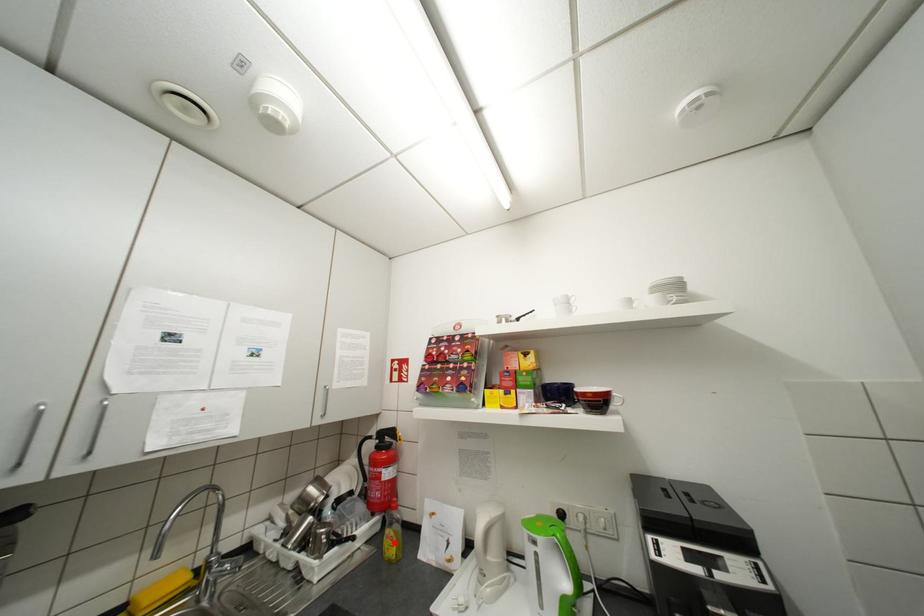
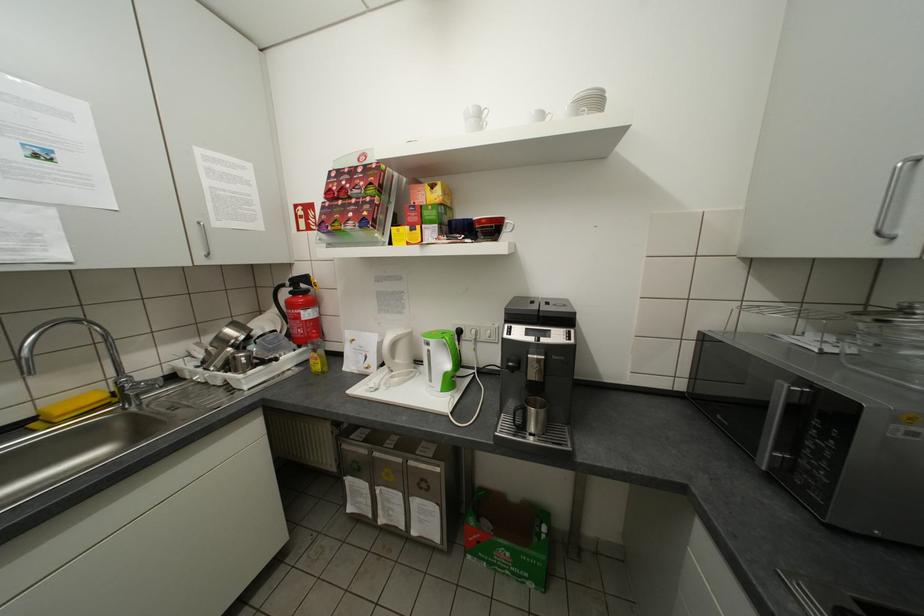
The point at the highlighted location is marked in the first image. Where is the corresponding point in the second image?

(321, 362)